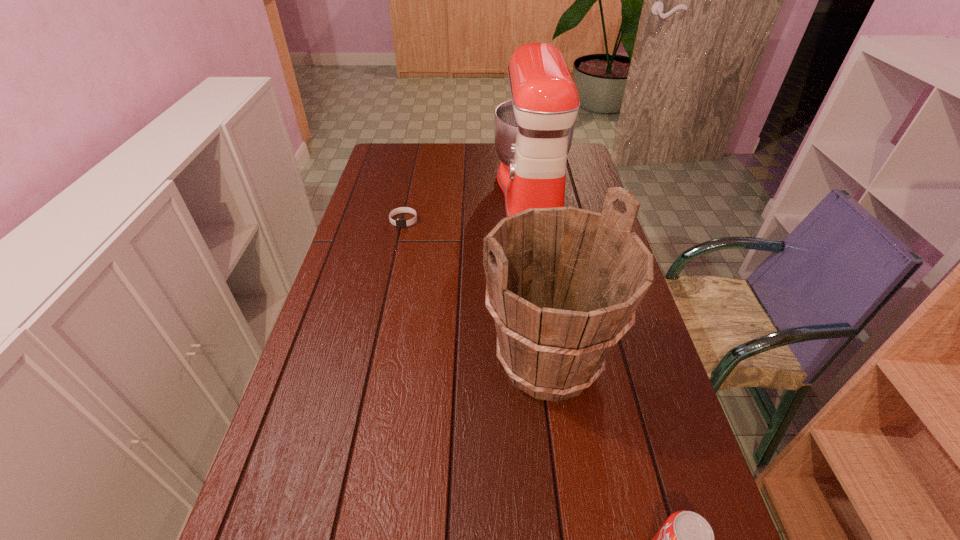
This screenshot has width=960, height=540. Identify the location of mixer. (533, 132).

The height and width of the screenshot is (540, 960). I want to click on the second nearest object, so click(562, 284).

Where is `the shortest object`? This screenshot has height=540, width=960. the shortest object is located at coordinates (399, 223).

You are a GUI agent. You are given a task and a screenshot of the screen. Output one action in this format:
    pyautogui.click(x=<x>, y=<y>)
    Task: Click on the leftmost object
    The height and width of the screenshot is (540, 960).
    Given the screenshot: What is the action you would take?
    pyautogui.click(x=399, y=223)

Image resolution: width=960 pixels, height=540 pixels. What are the coordinates of `vacant space located on the front-facing side of the mixer` in the screenshot? It's located at (434, 193).

This screenshot has height=540, width=960. I want to click on vacant position located on the front-facing side of the mixer, so click(401, 193).

The width and height of the screenshot is (960, 540). In order to click on vacant region located on the front-facing side of the mixer in this screenshot , I will do `click(477, 193)`.

This screenshot has width=960, height=540. I want to click on vacant space located on the front of the bucket, so click(566, 484).

Locate an element on the screen. This screenshot has height=540, width=960. free space located on the outer surface of the wristband is located at coordinates (389, 289).

Identify the location of object that is positioned at the far edge. (533, 132).